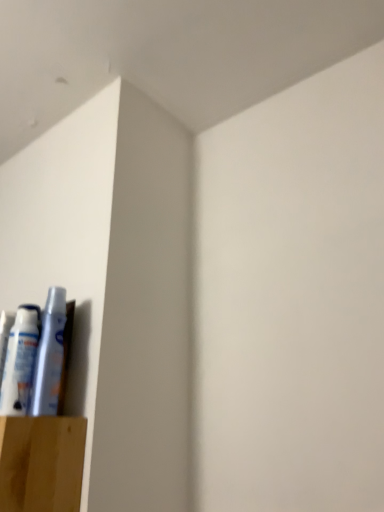
In order to face white plastic tube at lower left, arranged as the 1th toiletry when viewed from the right, should I rotate leftwards or rightwards?

To face it directly, rotate left by 17.859 degrees.

I want to click on white plastic tube at lower left, positioned as the 2th toiletry in left-to-right order, so click(x=49, y=356).

Image resolution: width=384 pixels, height=512 pixels. What do you see at coordinates (49, 356) in the screenshot? I see `white plastic tube at lower left, arranged as the 1th toiletry when viewed from the right` at bounding box center [49, 356].

At what (x,y) coordinates should I click in order to perform the action: click on white matte tube at lower left, which is the 2th toiletry from right to left. Please return your answer as a coordinate pair (x, y). This screenshot has width=384, height=512. Looking at the image, I should click on (19, 362).

This screenshot has width=384, height=512. Describe the element at coordinates (19, 362) in the screenshot. I see `white matte tube at lower left, which is the first toiletry in left-to-right order` at that location.

At what (x,y) coordinates should I click in order to perform the action: click on white plastic tube at lower left, arranged as the 1th toiletry when viewed from the right. Please return your answer as a coordinate pair (x, y). The width and height of the screenshot is (384, 512). Looking at the image, I should click on (49, 356).

In the scene shown: Which is more to the left, white matte tube at lower left, which is the 2th toiletry from right to left, or white plastic tube at lower left, arranged as the 1th toiletry when viewed from the right?

From the viewer's perspective, white matte tube at lower left, which is the 2th toiletry from right to left, appears more on the left side.

In the scene shown: Between white matte tube at lower left, which is the 2th toiletry from right to left, and white plastic tube at lower left, arranged as the 1th toiletry when viewed from the right, which one is positioned behind?

white matte tube at lower left, which is the 2th toiletry from right to left, is behind.

Which is farther from the camera, (25, 351) or (37, 377)?

The point (25, 351) is farther from the camera.

From the image's perspective, is white matte tube at lower left, which is the 2th toiletry from right to left, above white plastic tube at lower left, positioned as the 2th toiletry in left-to-right order?

No, from the image's perspective, white matte tube at lower left, which is the 2th toiletry from right to left, is not over white plastic tube at lower left, positioned as the 2th toiletry in left-to-right order.

From a real-world perspective, between white matte tube at lower left, which is the first toiletry in left-to-right order, and white plastic tube at lower left, positioned as the 2th toiletry in left-to-right order, who is vertically lower?

white matte tube at lower left, which is the first toiletry in left-to-right order.

Between white matte tube at lower left, which is the 2th toiletry from right to left, and white plastic tube at lower left, arranged as the 1th toiletry when viewed from the right, which one has smaller width?

white plastic tube at lower left, arranged as the 1th toiletry when viewed from the right, is thinner.

Which of these two, white matte tube at lower left, which is the 2th toiletry from right to left, or white plastic tube at lower left, positioned as the 2th toiletry in left-to-right order, stands taller?

With more height is white plastic tube at lower left, positioned as the 2th toiletry in left-to-right order.

Which of these two, white matte tube at lower left, which is the 2th toiletry from right to left, or white plastic tube at lower left, arranged as the 1th toiletry when viewed from the right, is bigger?

white matte tube at lower left, which is the 2th toiletry from right to left, is bigger.

Is white matte tube at lower left, which is the 2th toiletry from right to left, positioned beyond the bounds of white plastic tube at lower left, arranged as the 1th toiletry when viewed from the right?

Yes, white matte tube at lower left, which is the 2th toiletry from right to left, is outside of white plastic tube at lower left, arranged as the 1th toiletry when viewed from the right.

Is white matte tube at lower left, which is the 2th toiletry from right to left, beside white plastic tube at lower left, positioned as the 2th toiletry in left-to-right order?

Yes, white matte tube at lower left, which is the 2th toiletry from right to left, is right next to white plastic tube at lower left, positioned as the 2th toiletry in left-to-right order, and making contact.

Does white matte tube at lower left, which is the first toiletry in left-to-right order, turn towards white plastic tube at lower left, arranged as the 1th toiletry when viewed from the right?

No, white matte tube at lower left, which is the first toiletry in left-to-right order, does not turn towards white plastic tube at lower left, arranged as the 1th toiletry when viewed from the right.

Could you measure the distance between white matte tube at lower left, which is the first toiletry in left-to-right order, and white plastic tube at lower left, arranged as the 1th toiletry when viewed from the right?

A distance of 1.25 inches exists between white matte tube at lower left, which is the first toiletry in left-to-right order, and white plastic tube at lower left, arranged as the 1th toiletry when viewed from the right.

Image resolution: width=384 pixels, height=512 pixels. In order to click on toiletry below the white plastic tube at lower left, arranged as the 1th toiletry when viewed from the right (from the image's perspective) in this screenshot , I will do `click(19, 362)`.

Which is more to the left, white plastic tube at lower left, arranged as the 1th toiletry when viewed from the right, or white matte tube at lower left, which is the 2th toiletry from right to left?

Positioned to the left is white matte tube at lower left, which is the 2th toiletry from right to left.

In the scene shown: Does white plastic tube at lower left, arranged as the 1th toiletry when viewed from the right, come in front of white matte tube at lower left, which is the first toiletry in left-to-right order?

Yes, white plastic tube at lower left, arranged as the 1th toiletry when viewed from the right, is closer to the camera.

Considering the points (52, 311) and (12, 380), which point is in front, point (52, 311) or point (12, 380)?

Point (12, 380)

From the image's perspective, relative to white matte tube at lower left, which is the first toiletry in left-to-right order, is white plastic tube at lower left, positioned as the 2th toiletry in left-to-right order, above or below?

white plastic tube at lower left, positioned as the 2th toiletry in left-to-right order, is above white matte tube at lower left, which is the first toiletry in left-to-right order.

From a real-world perspective, who is located lower, white plastic tube at lower left, arranged as the 1th toiletry when viewed from the right, or white matte tube at lower left, which is the 2th toiletry from right to left?

From a 3D spatial view, white matte tube at lower left, which is the 2th toiletry from right to left, is below.

Is white plastic tube at lower left, arranged as the 1th toiletry when viewed from the right, wider than white matte tube at lower left, which is the first toiletry in left-to-right order?

In fact, white plastic tube at lower left, arranged as the 1th toiletry when viewed from the right, might be narrower than white matte tube at lower left, which is the first toiletry in left-to-right order.

Can you confirm if white plastic tube at lower left, positioned as the 2th toiletry in left-to-right order, is shorter than white matte tube at lower left, which is the 2th toiletry from right to left?

Incorrect, the height of white plastic tube at lower left, positioned as the 2th toiletry in left-to-right order, does not fall short of that of white matte tube at lower left, which is the 2th toiletry from right to left.

In terms of size, does white plastic tube at lower left, arranged as the 1th toiletry when viewed from the right, appear bigger or smaller than white matte tube at lower left, which is the first toiletry in left-to-right order?

In the image, white plastic tube at lower left, arranged as the 1th toiletry when viewed from the right, appears to be smaller than white matte tube at lower left, which is the first toiletry in left-to-right order.

Is white plastic tube at lower left, positioned as the 2th toiletry in left-to-right order, located outside white matte tube at lower left, which is the first toiletry in left-to-right order?

Absolutely, white plastic tube at lower left, positioned as the 2th toiletry in left-to-right order, is external to white matte tube at lower left, which is the first toiletry in left-to-right order.

Consider the image. Are white plastic tube at lower left, arranged as the 1th toiletry when viewed from the right, and white matte tube at lower left, which is the first toiletry in left-to-right order, far apart?

No, white plastic tube at lower left, arranged as the 1th toiletry when viewed from the right, is not far from white matte tube at lower left, which is the first toiletry in left-to-right order.

Is white plastic tube at lower left, positioned as the 2th toiletry in left-to-right order, oriented towards white matte tube at lower left, which is the 2th toiletry from right to left?

No, white plastic tube at lower left, positioned as the 2th toiletry in left-to-right order, is not oriented towards white matte tube at lower left, which is the 2th toiletry from right to left.

How different are the orientations of white plastic tube at lower left, arranged as the 1th toiletry when viewed from the right, and white matte tube at lower left, which is the first toiletry in left-to-right order, in degrees?

They differ by 0.00442 degrees in their facing directions.

Where is `toiletry lying behind the white plastic tube at lower left, positioned as the 2th toiletry in left-to-right order`? toiletry lying behind the white plastic tube at lower left, positioned as the 2th toiletry in left-to-right order is located at coordinates (19, 362).

You are a GUI agent. You are given a task and a screenshot of the screen. Output one action in this format:
    pyautogui.click(x=<x>, y=<y>)
    Task: Click on the toiletry above the white matte tube at lower left, which is the 2th toiletry from right to left (from the image's perspective)
    This screenshot has width=384, height=512.
    Given the screenshot: What is the action you would take?
    pyautogui.click(x=49, y=356)

Where is `toiletry located above the white matte tube at lower left, which is the first toiletry in left-to-right order (from a real-world perspective)`? The image size is (384, 512). toiletry located above the white matte tube at lower left, which is the first toiletry in left-to-right order (from a real-world perspective) is located at coordinates coord(49,356).